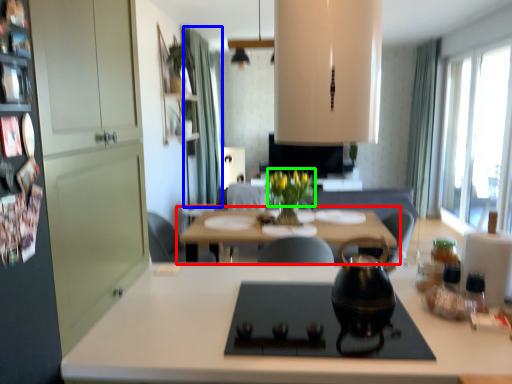
Question: Based on their relative distances, which object is nearer to table (highlighted by a red box)? Choose from curtain (highlighted by a blue box) and flower (highlighted by a green box).

Choices:
 (A) curtain
 (B) flower

Answer: (B)